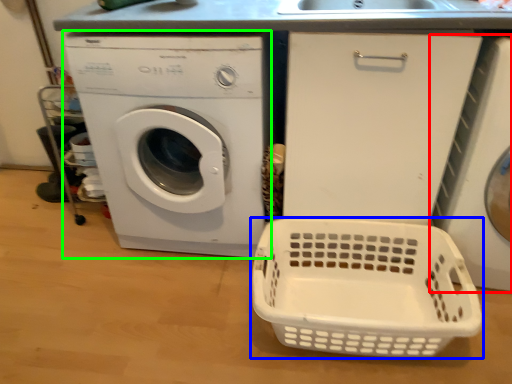
Question: Estimate the real-world distances between objects in this image. Which object is farther from washing machine (highlighted by a red box), basket (highlighted by a blue box) or washing machine (highlighted by a green box)?

Choices:
 (A) basket
 (B) washing machine

Answer: (B)